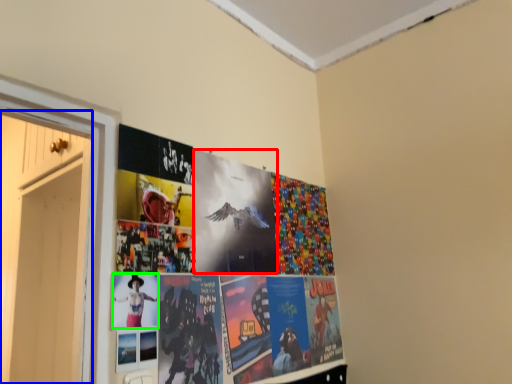
Question: Estimate the real-world distances between objects in this image. Which object is closer to flyer (highlighted by a red box), door (highlighted by a blue box) or person (highlighted by a green box)?

Choices:
 (A) door
 (B) person

Answer: (B)